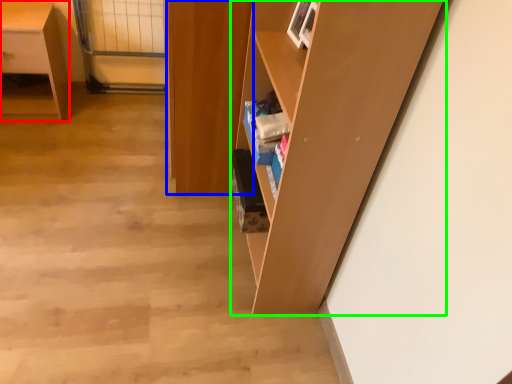
Question: Based on their relative distances, which object is farther from desk (highlighted by a red box)? Choose from cabinetry (highlighted by a blue box) and shelf (highlighted by a green box).

Choices:
 (A) cabinetry
 (B) shelf

Answer: (B)